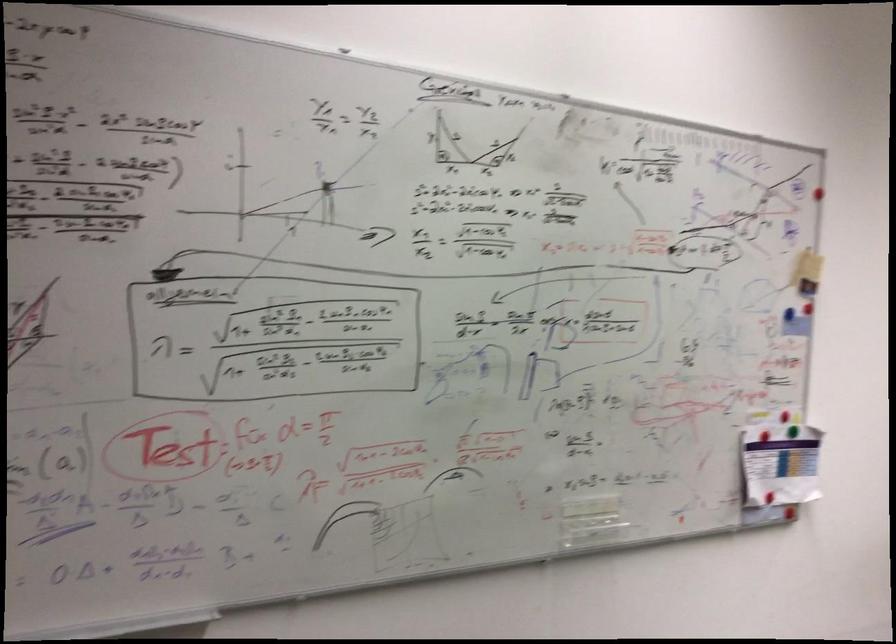
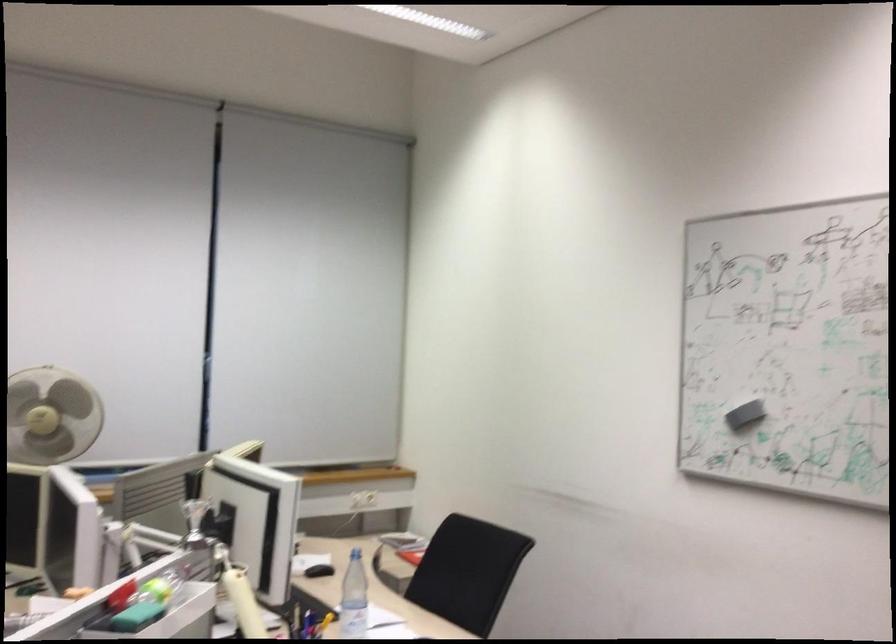
Question: How did the camera likely rotate?

Choices:
 (A) Left
 (B) Right
 (C) Up
 (D) Down

Answer: (B)